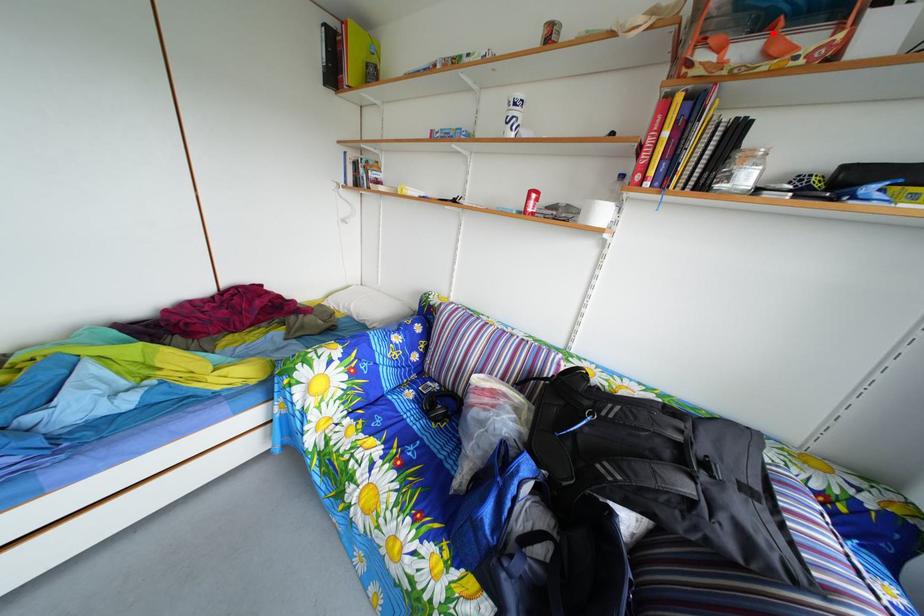
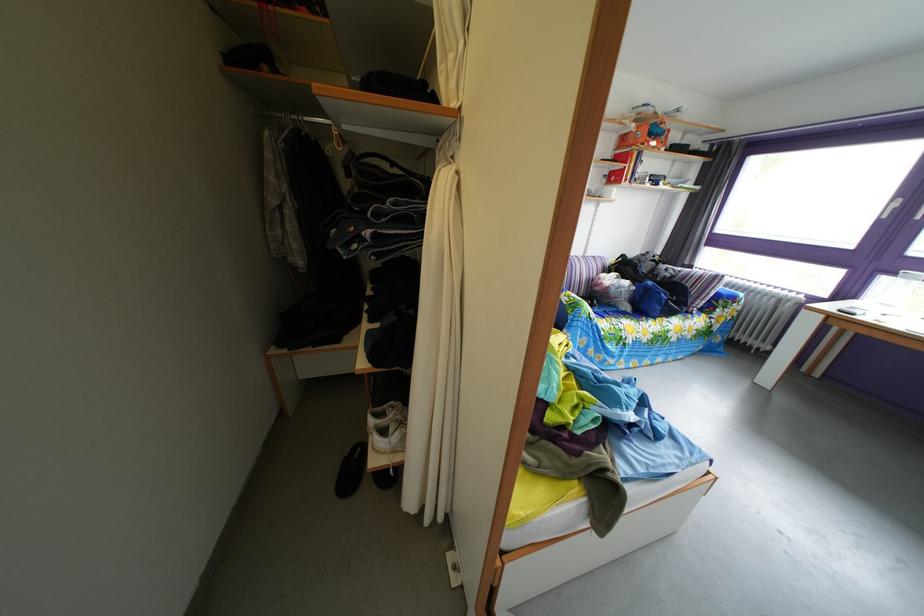
The point at the highlighted location is marked in the first image. Where is the corresponding point in the second image?

(661, 144)